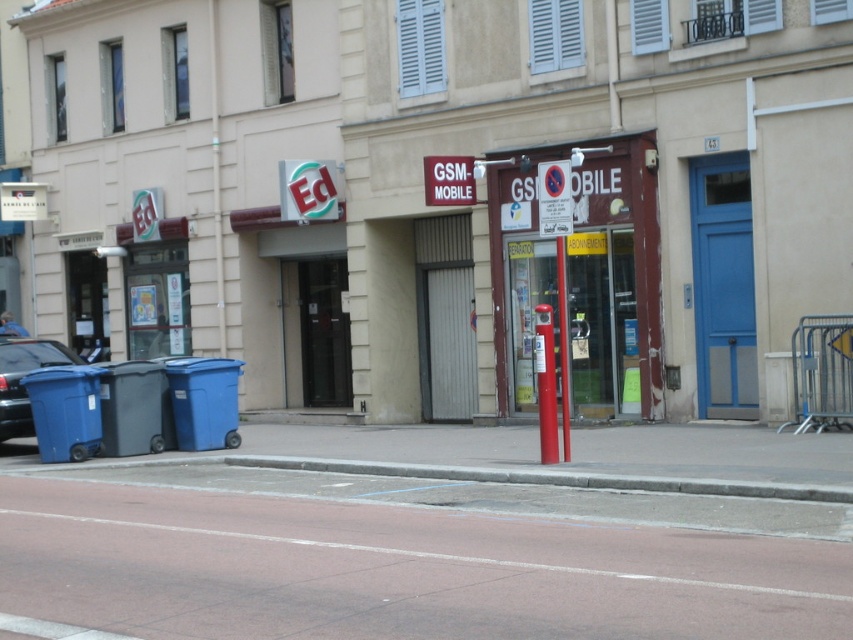
Question: Does metallic blue car at left appear under red plastic pole at center?

Choices:
 (A) yes
 (B) no

Answer: (B)

Question: Observing the image, what is the correct spatial positioning of metallic blue car at left in reference to red plastic pole at center?

Choices:
 (A) below
 (B) above

Answer: (B)

Question: Which object is positioned closest to the concrete at lower center?

Choices:
 (A) metallic blue car at left
 (B) red plastic pole at center

Answer: (B)

Question: Is metallic blue car at left to the right of red plastic pole at center from the viewer's perspective?

Choices:
 (A) no
 (B) yes

Answer: (A)

Question: Estimate the real-world distances between objects in this image. Which object is closer to the concrete at lower center?

Choices:
 (A) red plastic pole at center
 (B) metallic blue car at left

Answer: (A)

Question: Among these points, which one is nearest to the camera?

Choices:
 (A) (561, 358)
 (B) (20, 417)
 (C) (740, 492)

Answer: (C)